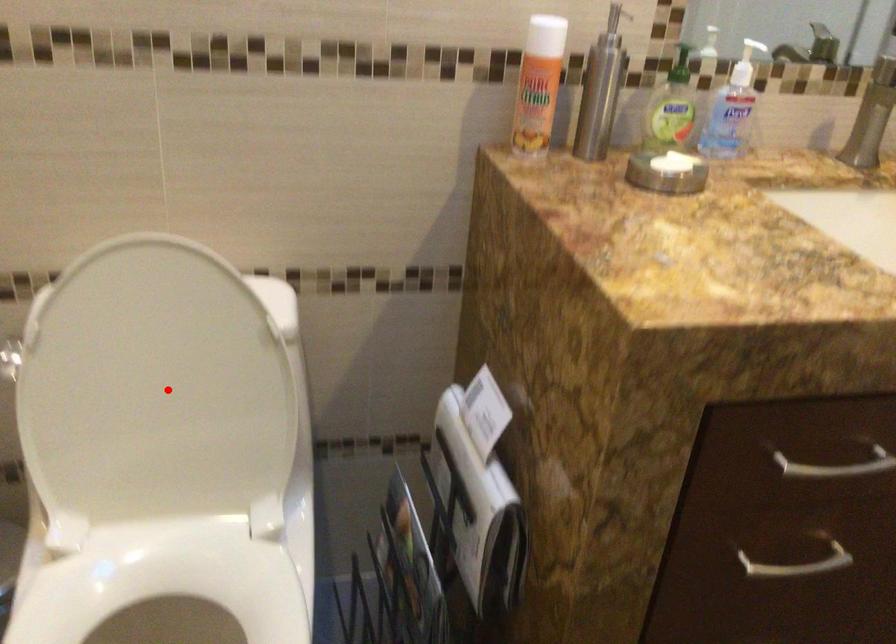
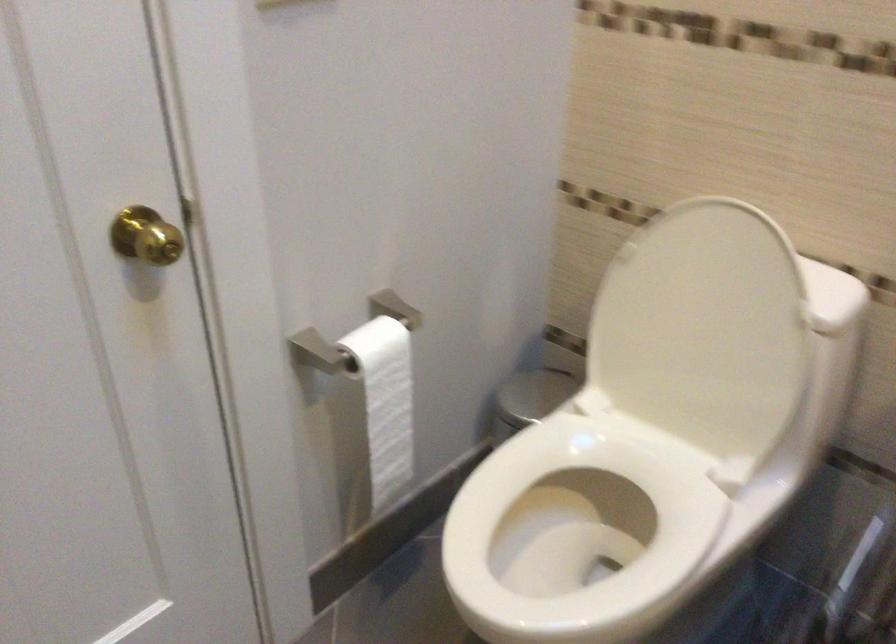
Question: A red point is marked in image1. In image2, is the corresponding 3D point closer to the camera or farther? Reply with the corresponding letter.

Choices:
 (A) The corresponding 3D point is closer.
 (B) The corresponding 3D point is farther.

Answer: (B)